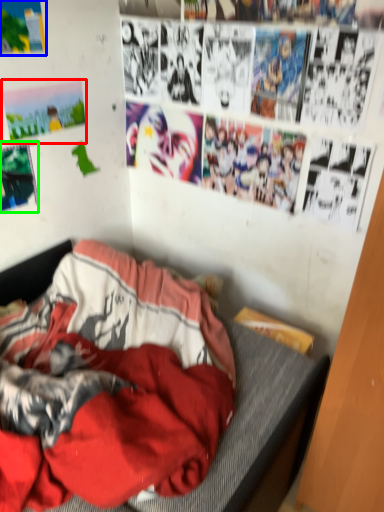
Question: Which is farther away from poster page (highlighted by a red box)? poster page (highlighted by a blue box) or poster page (highlighted by a green box)?

Choices:
 (A) poster page
 (B) poster page

Answer: (A)